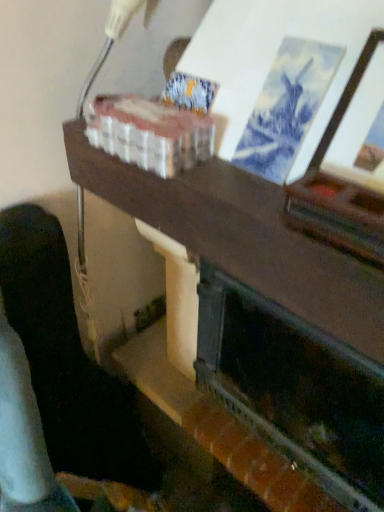
Question: Should I look upward or downward to see dark wood table at center?

Choices:
 (A) up
 (B) down

Answer: (B)

Question: Does dark green painted wood fireplace at center have a smaller size compared to dark wood table at center?

Choices:
 (A) no
 (B) yes

Answer: (B)

Question: Is dark green painted wood fireplace at center bigger than dark wood table at center?

Choices:
 (A) no
 (B) yes

Answer: (A)

Question: Can you confirm if dark green painted wood fireplace at center is wider than dark wood table at center?

Choices:
 (A) yes
 (B) no

Answer: (B)

Question: From the image's perspective, would you say dark green painted wood fireplace at center is positioned over dark wood table at center?

Choices:
 (A) no
 (B) yes

Answer: (A)

Question: Is dark green painted wood fireplace at center positioned with its back to dark wood table at center?

Choices:
 (A) no
 (B) yes

Answer: (B)

Question: Is dark green painted wood fireplace at center closer to the viewer compared to dark wood table at center?

Choices:
 (A) yes
 (B) no

Answer: (B)

Question: Could you tell me if dark wood table at center is turned towards dark wood shelf at lower left?

Choices:
 (A) yes
 (B) no

Answer: (A)

Question: Is dark wood shelf at lower left at the back of dark wood table at center?

Choices:
 (A) no
 (B) yes

Answer: (A)

Question: Considering the relative sizes of dark wood table at center and dark wood shelf at lower left in the image provided, is dark wood table at center wider than dark wood shelf at lower left?

Choices:
 (A) no
 (B) yes

Answer: (B)

Question: Considering the relative sizes of dark wood table at center and dark wood shelf at lower left in the image provided, is dark wood table at center shorter than dark wood shelf at lower left?

Choices:
 (A) yes
 (B) no

Answer: (A)

Question: Does dark wood table at center come behind dark wood shelf at lower left?

Choices:
 (A) no
 (B) yes

Answer: (A)

Question: From a real-world perspective, is dark wood table at center physically below dark wood shelf at lower left?

Choices:
 (A) yes
 (B) no

Answer: (B)

Question: Would you consider dark wood shelf at lower left to be distant from dark green painted wood fireplace at center?

Choices:
 (A) no
 (B) yes

Answer: (A)